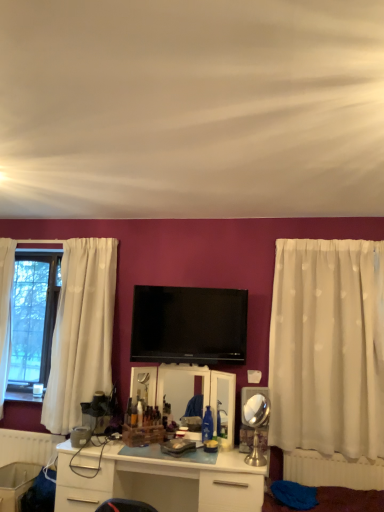
Question: Considering their positions, is flat screen tv at center located in front of or behind white plastic radiator at lower right, marked as the 2th radiator in a left-to-right arrangement?

Choices:
 (A) front
 (B) behind

Answer: (B)

Question: From a real-world perspective, is flat screen tv at center positioned above or below white plastic radiator at lower right, marked as the 2th radiator in a left-to-right arrangement?

Choices:
 (A) above
 (B) below

Answer: (A)

Question: Based on their relative distances, which object is farther from the white sheer curtain at right?

Choices:
 (A) white plastic radiator at lower right, which is the second radiator from back to front
 (B) flat screen tv at center
 (C) white glossy desk at center
 (D) white plastic radiator at lower left, which ranks as the first radiator in back-to-front order

Answer: (D)

Question: Which is farther from the white sheer curtain at right?

Choices:
 (A) flat screen tv at center
 (B) white plastic radiator at lower right, the 1th radiator viewed from the front
 (C) white plastic radiator at lower left, the 1th radiator from the left
 (D) white glossy desk at center

Answer: (C)